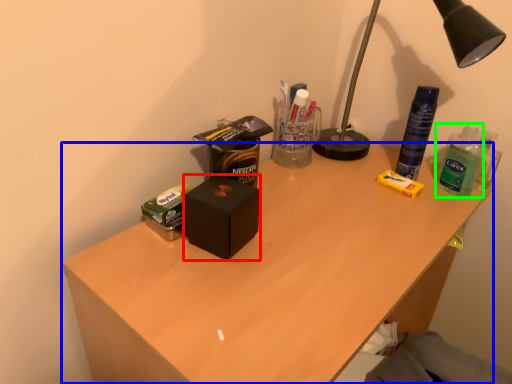
Question: Which is farther away from box (highlighted by a red box)? desk (highlighted by a blue box) or bottle (highlighted by a green box)?

Choices:
 (A) desk
 (B) bottle

Answer: (B)